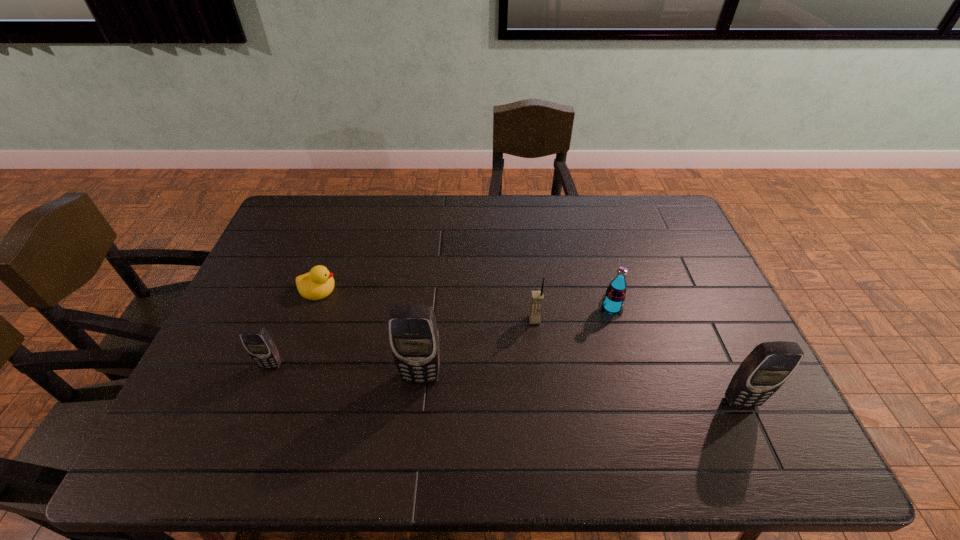
You are a GUI agent. You are given a task and a screenshot of the screen. Output one action in this format:
    pyautogui.click(x=<x>, y=<y>)
    Task: Click on the vacant space located 0.110m on the face of the shortest object
    The height and width of the screenshot is (540, 960).
    Given the screenshot: What is the action you would take?
    pyautogui.click(x=374, y=289)

Locate an element on the screen. The image size is (960, 540). vacant region located 0.300m on the back of the second object from right to left is located at coordinates (591, 234).

Locate an element on the screen. This screenshot has width=960, height=540. cellular telephone that is at the left edge is located at coordinates (256, 340).

At what (x,y) coordinates should I click in order to perform the action: click on duckling that is at the left edge. Please return your answer as a coordinate pair (x, y). The image size is (960, 540). Looking at the image, I should click on (317, 284).

Find the location of a particular element. This screenshot has height=540, width=960. object that is at the right edge is located at coordinates (767, 367).

Image resolution: width=960 pixels, height=540 pixels. In order to click on object located in the near right corner section of the desktop in this screenshot , I will do `click(767, 367)`.

In the image, there is a desktop. Identify the location of vacant space at the far edge. This screenshot has width=960, height=540. (411, 203).

You are a GUI agent. You are given a task and a screenshot of the screen. Output one action in this format:
    pyautogui.click(x=<x>, y=<y>)
    Task: Click on the vacant space at the near edge of the desktop
    The height and width of the screenshot is (540, 960).
    Given the screenshot: What is the action you would take?
    pyautogui.click(x=270, y=405)

In the image, there is a desktop. At what (x,y) coordinates should I click in order to perform the action: click on vacant space at the left edge. Please return your answer as a coordinate pair (x, y). Image resolution: width=960 pixels, height=540 pixels. Looking at the image, I should click on (234, 309).

Identify the location of free space at the right edge. The height and width of the screenshot is (540, 960). [x=720, y=298].